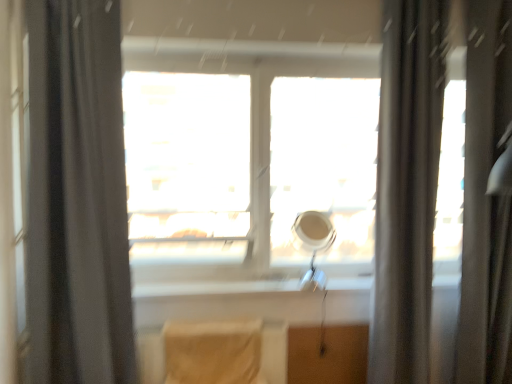
At what (x,y) coordinates should I click in order to perform the action: click on matte gray curtain at right, the 1th curtain when ordered from right to left. Please return your answer as a coordinate pair (x, y). Looking at the image, I should click on 407,188.

I want to click on black fabric curtain at left, which is the 1th curtain in left-to-right order, so click(x=77, y=197).

What do you see at coordinates (248, 166) in the screenshot? The width and height of the screenshot is (512, 384). I see `transparent glass window at center` at bounding box center [248, 166].

The width and height of the screenshot is (512, 384). Identify the location of matte gray curtain at right, the 1th curtain when ordered from right to left. (407, 188).

Between beige fabric chair at center and transparent glass window at center, which one has less height?

Standing shorter between the two is beige fabric chair at center.

Who is more distant, beige fabric chair at center or transparent glass window at center?

transparent glass window at center is further from the camera.

Is beige fabric chair at center at the left side of transparent glass window at center?

Correct, you'll find beige fabric chair at center to the left of transparent glass window at center.

Can you tell me how much beige fabric chair at center and transparent glass window at center differ in facing direction?

The angle between the facing direction of beige fabric chair at center and the facing direction of transparent glass window at center is 0.752 degrees.

Which object is more forward, matte gray curtain at right, the 1th curtain when ordered from right to left, or silky gray shower curtain at right?

Positioned in front is matte gray curtain at right, the 1th curtain when ordered from right to left.

From a real-world perspective, count 1st curtains upward from the silky gray shower curtain at right and point to it. Please provide its 2D coordinates.

[(407, 188)]

Could you measure the distance between matte gray curtain at right, the 1th curtain when ordered from right to left, and silky gray shower curtain at right?

matte gray curtain at right, the 1th curtain when ordered from right to left, is 4.96 inches away from silky gray shower curtain at right.

Considering the relative sizes of matte gray curtain at right, which appears as the 2th curtain when viewed from the left, and silky gray shower curtain at right in the image provided, is matte gray curtain at right, which appears as the 2th curtain when viewed from the left, thinner than silky gray shower curtain at right?

In fact, matte gray curtain at right, which appears as the 2th curtain when viewed from the left, might be wider than silky gray shower curtain at right.

From a real-world perspective, is transparent glass window at center positioned under beige fabric chair at center based on gravity?

Incorrect, from a real-world perspective, transparent glass window at center is higher than beige fabric chair at center.

How much distance is there between transparent glass window at center and beige fabric chair at center?

transparent glass window at center is 68.09 centimeters away from beige fabric chair at center.

Considering the sizes of objects transparent glass window at center and beige fabric chair at center in the image provided, who is wider, transparent glass window at center or beige fabric chair at center?

With larger width is beige fabric chair at center.

Is beige fabric chair at center at the back of transparent glass window at center?

That's not correct — transparent glass window at center is not looking away from beige fabric chair at center.

Considering the relative positions of matte gray curtain at right, which appears as the 2th curtain when viewed from the left, and transparent glass window at center in the image provided, is matte gray curtain at right, which appears as the 2th curtain when viewed from the left, to the left of transparent glass window at center from the viewer's perspective?

No.

Consider the image. From a real-world perspective, which is physically below, matte gray curtain at right, the 1th curtain when ordered from right to left, or transparent glass window at center?

matte gray curtain at right, the 1th curtain when ordered from right to left.

Is matte gray curtain at right, the 1th curtain when ordered from right to left, facing towards transparent glass window at center?

No, matte gray curtain at right, the 1th curtain when ordered from right to left, is not facing towards transparent glass window at center.

Which object is positioned more to the left, black fabric curtain at left, which is the 1th curtain in left-to-right order, or matte gray curtain at right, which appears as the 2th curtain when viewed from the left?

From the viewer's perspective, black fabric curtain at left, which is the 1th curtain in left-to-right order, appears more on the left side.

Based on their sizes in the image, would you say black fabric curtain at left, placed as the 2th curtain when sorted from right to left, is bigger or smaller than matte gray curtain at right, which appears as the 2th curtain when viewed from the left?

Considering their sizes, black fabric curtain at left, placed as the 2th curtain when sorted from right to left, takes up less space than matte gray curtain at right, which appears as the 2th curtain when viewed from the left.

Which point is more distant from viewer, [91,16] or [389,311]?

The point [389,311] is behind.

Does black fabric curtain at left, which is the 1th curtain in left-to-right order, have a greater width compared to matte gray curtain at right, which appears as the 2th curtain when viewed from the left?

Yes.

Does point (343, 222) appear closer or farther from the camera than point (414, 361)?

Clearly, point (343, 222) is more distant from the camera than point (414, 361).

Are transparent glass window at center and matte gray curtain at right, which appears as the 2th curtain when viewed from the left, beside each other?

No, transparent glass window at center is not in contact with matte gray curtain at right, which appears as the 2th curtain when viewed from the left.

Measure the distance between transparent glass window at center and matte gray curtain at right, which appears as the 2th curtain when viewed from the left.

transparent glass window at center and matte gray curtain at right, which appears as the 2th curtain when viewed from the left, are 23.51 inches apart.

From the image's perspective, is transparent glass window at center located beneath matte gray curtain at right, the 1th curtain when ordered from right to left?

Incorrect, from the image's perspective, transparent glass window at center is higher than matte gray curtain at right, the 1th curtain when ordered from right to left.

Which point is more distant from viewer, (467, 210) or (133, 370)?

The point (467, 210) is farther.

Is silky gray shower curtain at right shorter than black fabric curtain at left, which is the 1th curtain in left-to-right order?

No, silky gray shower curtain at right is not shorter than black fabric curtain at left, which is the 1th curtain in left-to-right order.

Does silky gray shower curtain at right appear on the right side of black fabric curtain at left, placed as the 2th curtain when sorted from right to left?

Indeed, silky gray shower curtain at right is positioned on the right side of black fabric curtain at left, placed as the 2th curtain when sorted from right to left.

Is silky gray shower curtain at right thinner than black fabric curtain at left, placed as the 2th curtain when sorted from right to left?

Yes, silky gray shower curtain at right is thinner than black fabric curtain at left, placed as the 2th curtain when sorted from right to left.

Find the location of a particular element. Image resolution: width=512 pixels, height=384 pixels. window above the beige fabric chair at center (from a real-world perspective) is located at coordinates [x=248, y=166].

Find the location of `shower curtain behind the matte gray curtain at right, which appears as the 2th curtain when viewed from the left`. shower curtain behind the matte gray curtain at right, which appears as the 2th curtain when viewed from the left is located at coordinates (486, 199).

Estimate the real-world distances between objects in this image. Which object is further from matte gray curtain at right, the 1th curtain when ordered from right to left, transparent glass window at center or silky gray shower curtain at right?

Based on the image, transparent glass window at center appears to be further to matte gray curtain at right, the 1th curtain when ordered from right to left.

Which object lies further to the anchor point matte gray curtain at right, which appears as the 2th curtain when viewed from the left, beige fabric chair at center or silky gray shower curtain at right?

Among the two, beige fabric chair at center is located further to matte gray curtain at right, which appears as the 2th curtain when viewed from the left.

Estimate the real-world distances between objects in this image. Which object is closer to beige fabric chair at center, black fabric curtain at left, which is the 1th curtain in left-to-right order, or silky gray shower curtain at right?

Among the two, black fabric curtain at left, which is the 1th curtain in left-to-right order, is located nearer to beige fabric chair at center.

Looking at the image, which one is located further to silky gray shower curtain at right, transparent glass window at center or beige fabric chair at center?

beige fabric chair at center.

Considering their positions, is beige fabric chair at center positioned closer to transparent glass window at center than silky gray shower curtain at right?

Among the two, beige fabric chair at center is located nearer to transparent glass window at center.

Considering their positions, is beige fabric chair at center positioned closer to silky gray shower curtain at right than black fabric curtain at left, placed as the 2th curtain when sorted from right to left?

beige fabric chair at center is positioned closer to the anchor silky gray shower curtain at right.

Which object lies further to the anchor point silky gray shower curtain at right, black fabric curtain at left, which is the 1th curtain in left-to-right order, or transparent glass window at center?

Among the two, black fabric curtain at left, which is the 1th curtain in left-to-right order, is located further to silky gray shower curtain at right.

Considering their positions, is silky gray shower curtain at right positioned further to matte gray curtain at right, which appears as the 2th curtain when viewed from the left, than transparent glass window at center?

transparent glass window at center is further to matte gray curtain at right, which appears as the 2th curtain when viewed from the left.

Identify the location of window situated between beige fabric chair at center and silky gray shower curtain at right from left to right. (248, 166).

Find the location of a particular element. chair between black fabric curtain at left, placed as the 2th curtain when sorted from right to left, and silky gray shower curtain at right from left to right is located at coordinates (213, 352).

You are a GUI agent. You are given a task and a screenshot of the screen. Output one action in this format:
    pyautogui.click(x=<x>, y=<y>)
    Task: Click on the curtain located between transparent glass window at center and silky gray shower curtain at right in the left-right direction
    
    Given the screenshot: What is the action you would take?
    pyautogui.click(x=407, y=188)

Image resolution: width=512 pixels, height=384 pixels. I want to click on window between black fabric curtain at left, placed as the 2th curtain when sorted from right to left, and matte gray curtain at right, the 1th curtain when ordered from right to left, so click(x=248, y=166).